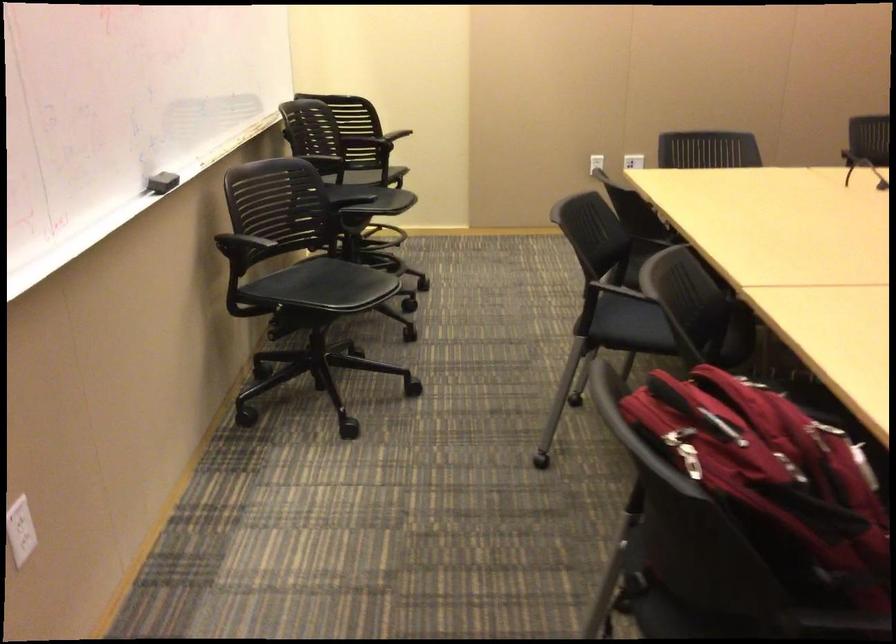
The location [161,182] corresponds to which object?

This point indicates the black whiteboard eraser.